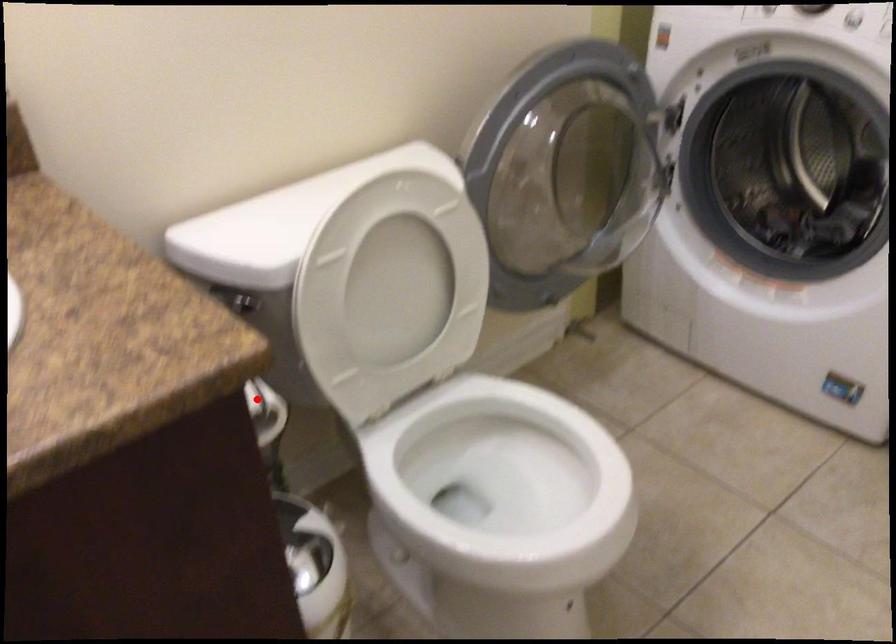
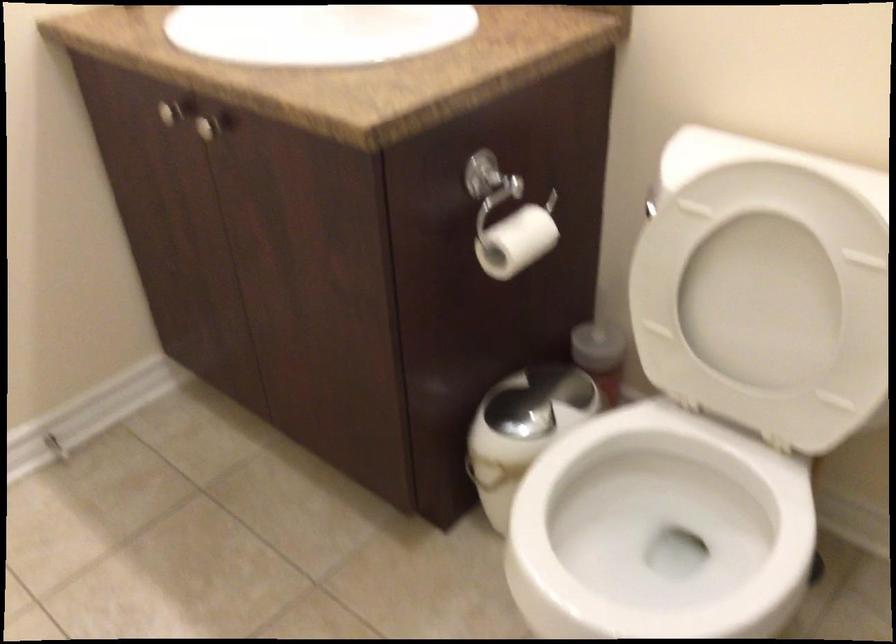
The point at the highlighted location is marked in the first image. Where is the corresponding point in the second image?

(515, 242)